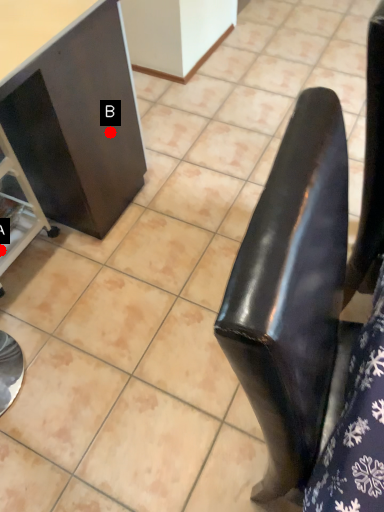
Question: Two points are circled on the image, labeled by A and B beside each circle. Which point appears closest to the camera in this image?

Choices:
 (A) A is closer
 (B) B is closer

Answer: (B)